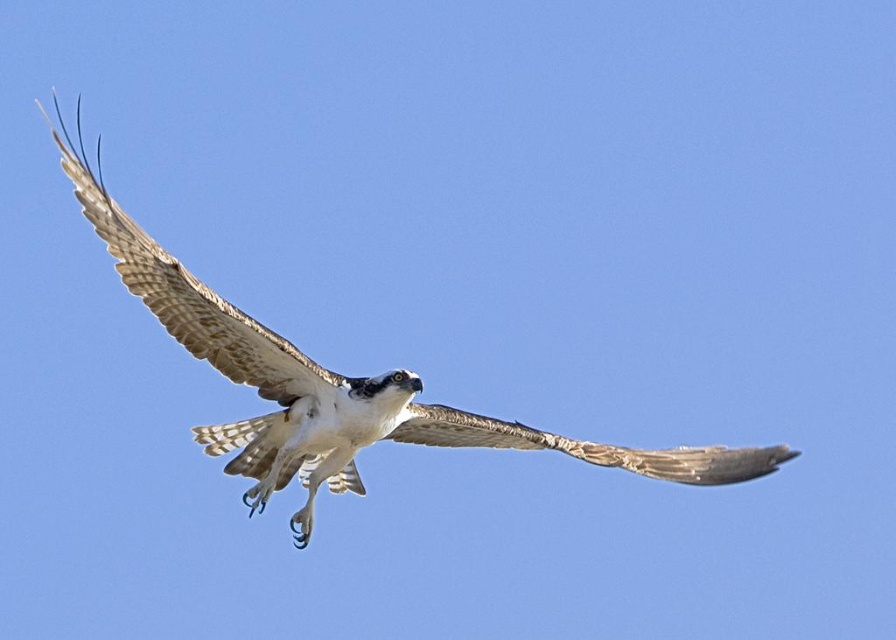
Is white feathered bird at center to the right of brown textured wing at center from the viewer's perspective?

In fact, white feathered bird at center is to the left of brown textured wing at center.

Does point (218, 440) come behind point (511, 433)?

Yes.

Image resolution: width=896 pixels, height=640 pixels. What are the coordinates of `white feathered bird at center` in the screenshot? It's located at click(x=333, y=385).

Consider the image. Which of these two, brown textured wing at upper left or brown textured wing at center, stands shorter?

Standing shorter between the two is brown textured wing at center.

Can you confirm if brown textured wing at upper left is positioned to the left of brown textured wing at center?

Correct, you'll find brown textured wing at upper left to the left of brown textured wing at center.

Is point (109, 227) closer to viewer compared to point (719, 448)?

Yes, point (109, 227) is closer to viewer.

Where is `brown textured wing at upper left`? This screenshot has height=640, width=896. brown textured wing at upper left is located at coordinates (194, 301).

Who is lower down, white feathered bird at center or brown textured wing at upper left?

white feathered bird at center

Who is more distant from viewer, (73, 161) or (115, 243)?

The point (115, 243) is more distant.

The width and height of the screenshot is (896, 640). In order to click on white feathered bird at center in this screenshot , I will do `click(333, 385)`.